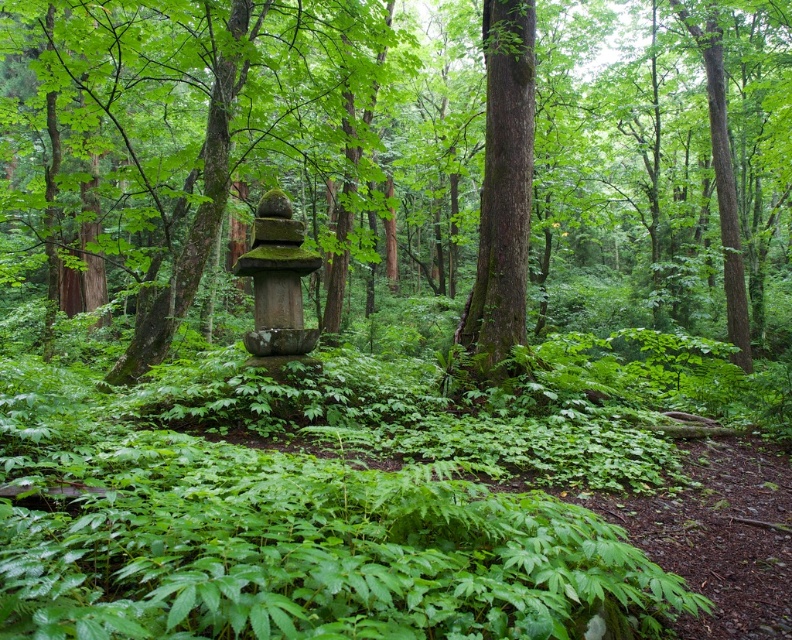
Does point (669, 308) come closer to viewer compared to point (492, 170)?

No, (669, 308) is behind (492, 170).

This screenshot has width=792, height=640. Describe the element at coordinates (406, 147) in the screenshot. I see `green mossy stone statue at center` at that location.

Locate an element on the screen. This screenshot has height=640, width=792. green mossy stone statue at center is located at coordinates (406, 147).

This screenshot has height=640, width=792. What are the coordinates of `green mossy stone statue at center` in the screenshot? It's located at (406, 147).